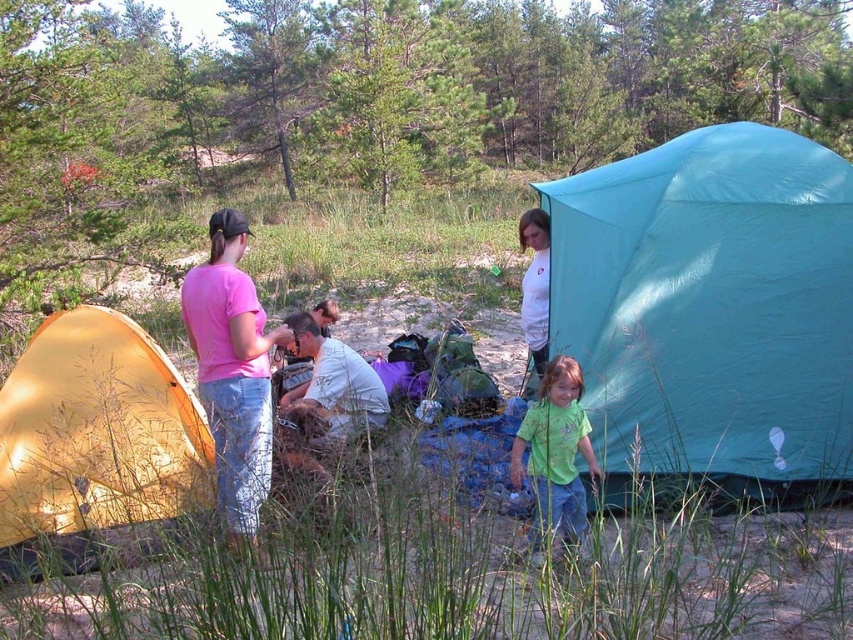
Question: Is green matte shirt at center wider than white cotton shirt at upper center?

Choices:
 (A) no
 (B) yes

Answer: (B)

Question: Is green matte shirt at center thinner than white cotton shirt at upper center?

Choices:
 (A) no
 (B) yes

Answer: (A)

Question: Based on their relative distances, which object is nearer to the teal fabric tent at right?

Choices:
 (A) green matte shirt at center
 (B) white cotton shirt at center
 (C) white cotton shirt at upper center

Answer: (A)

Question: Which point appears farthest from the camera in this image?

Choices:
 (A) (550, 394)
 (B) (244, 387)
 (C) (131, 420)

Answer: (A)

Question: Which of the following is the farthest from the observer?

Choices:
 (A) pink fabric shirt at left
 (B) teal fabric tent at right
 (C) matte yellow tent at left

Answer: (B)

Question: Does teal fabric tent at right appear on the left side of white cotton shirt at center?

Choices:
 (A) no
 (B) yes

Answer: (A)